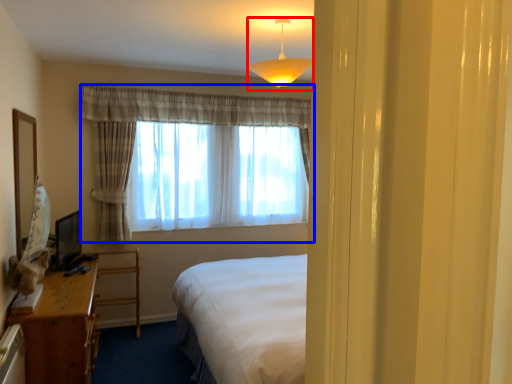
Question: Which point is closer to the camera, lamp (highlighted by a red box) or curtain (highlighted by a blue box)?

Choices:
 (A) lamp
 (B) curtain

Answer: (A)